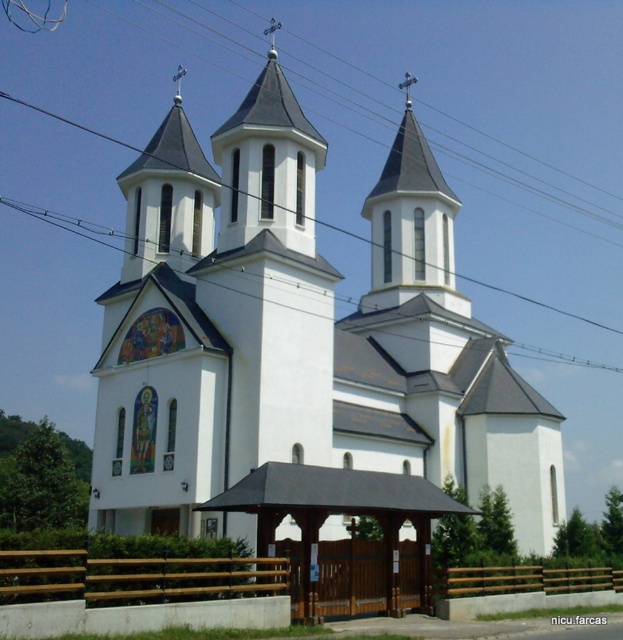
You are standing in front of the church and want to enter through the brown wooden gate at lower center. Which direction should you walk relative to the white smooth church at center to reach the gate?

The white smooth church at center is positioned on the left side of the brown wooden gate at lower center, so you should walk to the right side of the white smooth church at center to reach the gate.